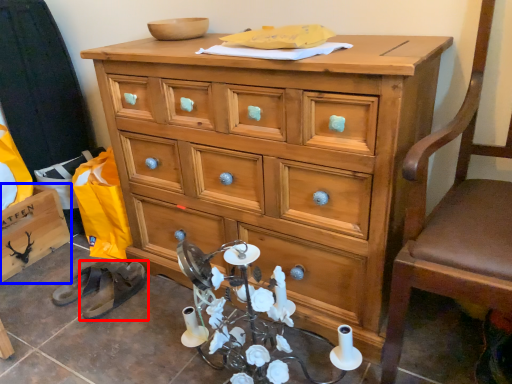
Question: Among these objects, which one is nearest to the camera, footwear (highlighted by a red box) or cabinetry (highlighted by a blue box)?

Choices:
 (A) footwear
 (B) cabinetry

Answer: (A)